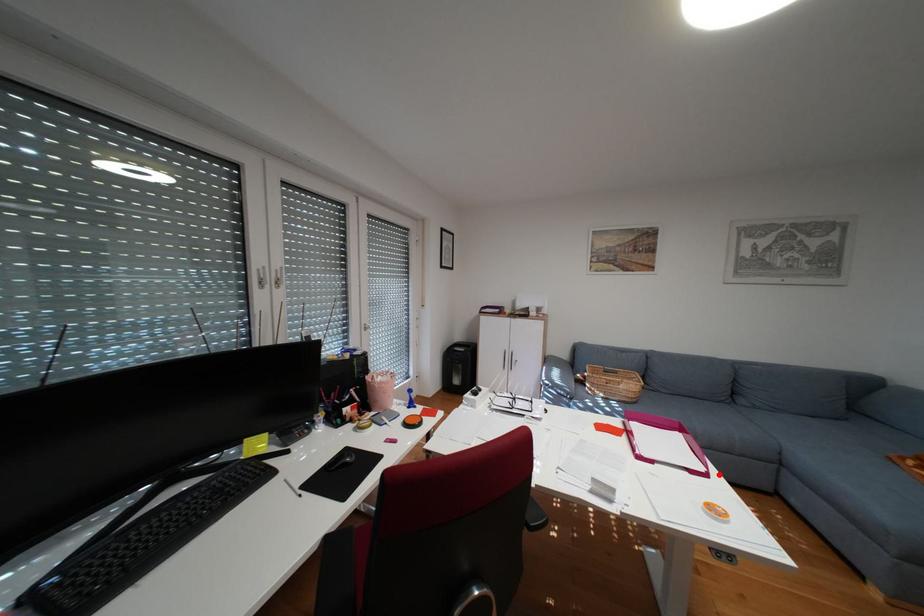
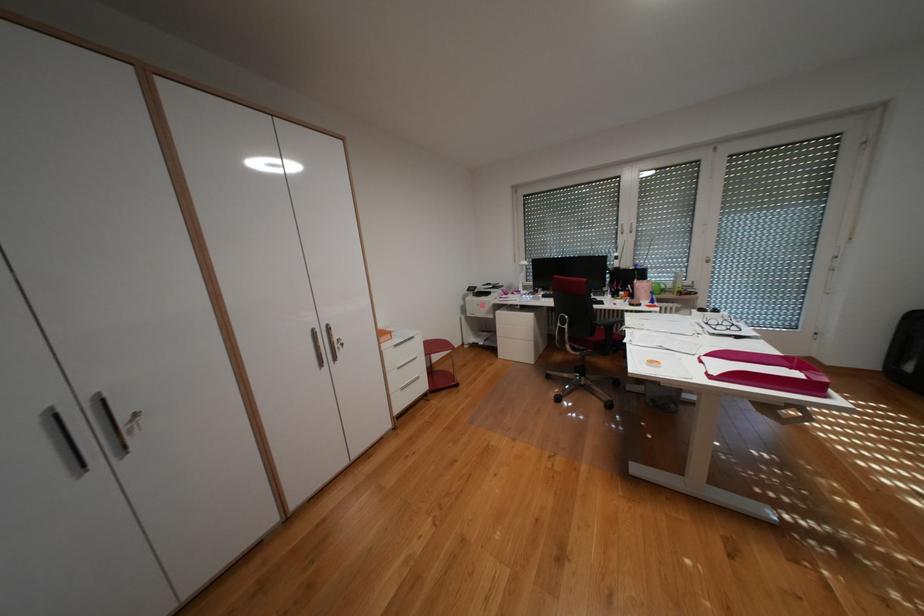
Find the pixel in the second image that matches the highlighted location in the first image.

(723, 377)